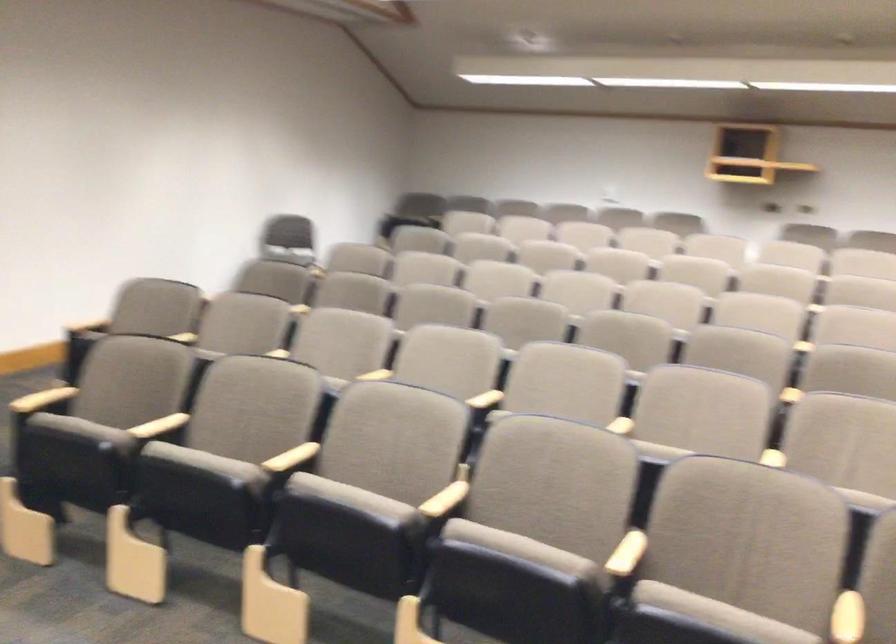
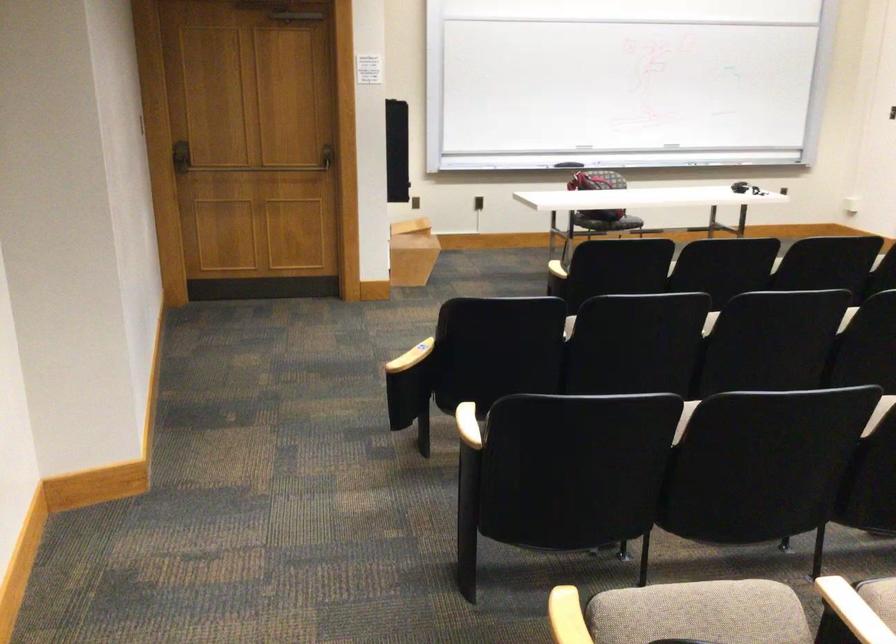
Question: In a continuous first-person perspective shot, in which direction is the camera moving?

Choices:
 (A) Left
 (B) Right
 (C) Forward
 (D) Backward

Answer: (D)